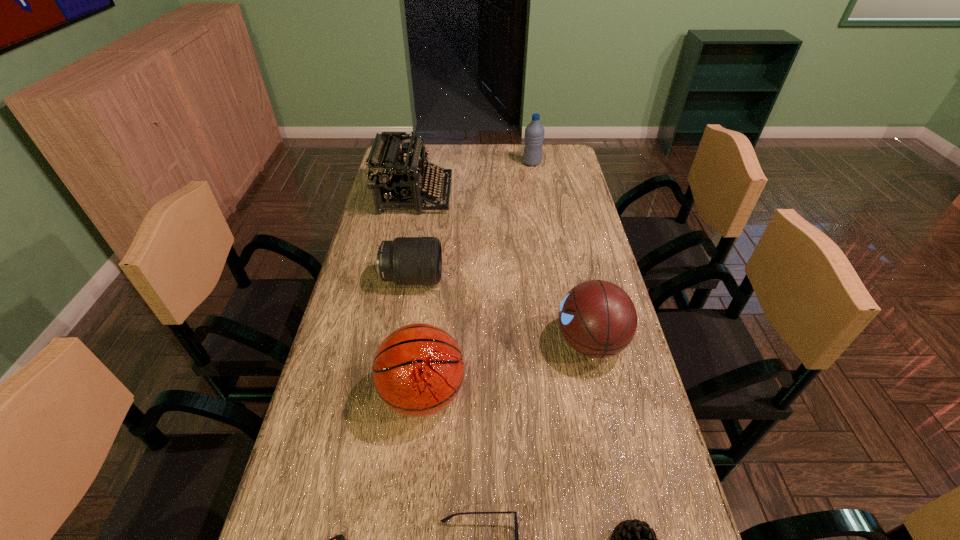
Locate an element on the screen. free space located 0.050m on the surface of the telephoto lens is located at coordinates (459, 279).

Image resolution: width=960 pixels, height=540 pixels. Identify the location of typewriter that is positioned at the far edge. (394, 180).

This screenshot has height=540, width=960. Find the location of `water bottle that is at the far edge`. water bottle that is at the far edge is located at coordinates (534, 133).

Image resolution: width=960 pixels, height=540 pixels. I want to click on typewriter located at the left edge, so click(394, 180).

The width and height of the screenshot is (960, 540). Identify the location of basketball present at the left edge. (418, 370).

Locate an element on the screen. telephoto lens that is at the left edge is located at coordinates (406, 260).

The height and width of the screenshot is (540, 960). I want to click on water bottle that is at the right edge, so click(534, 133).

Find the location of a particular element. The width and height of the screenshot is (960, 540). basketball that is at the right edge is located at coordinates (597, 318).

Identify the location of object positioned at the far left corner. The height and width of the screenshot is (540, 960). (394, 180).

This screenshot has height=540, width=960. I want to click on object situated at the far right corner, so click(x=534, y=133).